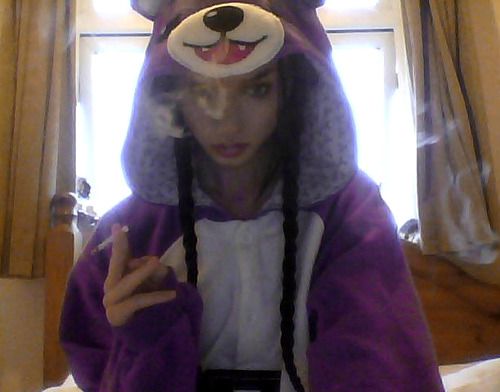
Where is `curtain`? The height and width of the screenshot is (392, 500). curtain is located at coordinates (442, 175).